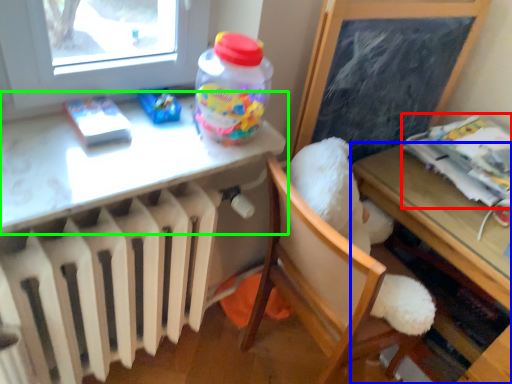
Question: Estimate the real-world distances between objects in this image. Which object is closer to magazine (highlighted by a red box), table (highlighted by a blue box) or table (highlighted by a green box)?

Choices:
 (A) table
 (B) table

Answer: (A)